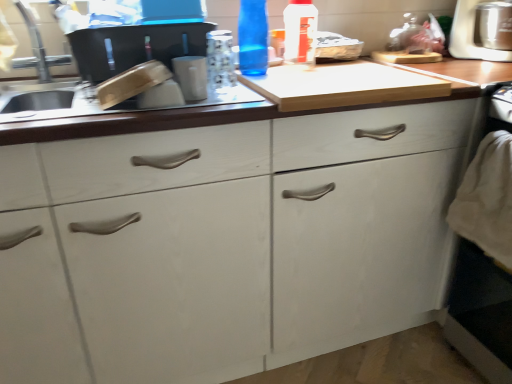
Identify the location of spots to the right of transparent plastic bottle at upper center, marked as the 1th bottle in a right-to-left arrangement. (364, 68).